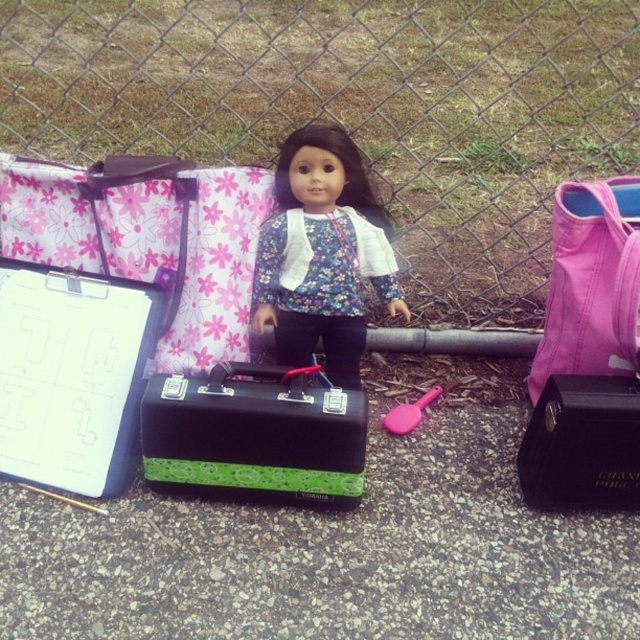
Question: Which point is closer to the camera?

Choices:
 (A) (140, 300)
 (B) (563, 240)
 (C) (593, 388)

Answer: (C)

Question: Does green matte suitcase at center come in front of black leather briefcase at center?

Choices:
 (A) no
 (B) yes

Answer: (A)

Question: Which point is farther from the camera taking this photo?

Choices:
 (A) (540, 449)
 (B) (385, 147)
 (C) (221, 461)
 (D) (579, 244)

Answer: (B)

Question: Can you confirm if metallic chain-link fence at upper center is smaller than pink plastic spoon at center?

Choices:
 (A) yes
 (B) no

Answer: (B)

Question: Can you confirm if green textured case at center is smaller than black leather briefcase at center?

Choices:
 (A) yes
 (B) no

Answer: (B)

Question: Which object appears farthest from the camera in this image?

Choices:
 (A) black leather briefcase at center
 (B) metallic chain-link fence at upper center
 (C) green matte suitcase at center
 (D) matte floral doll at center

Answer: (B)